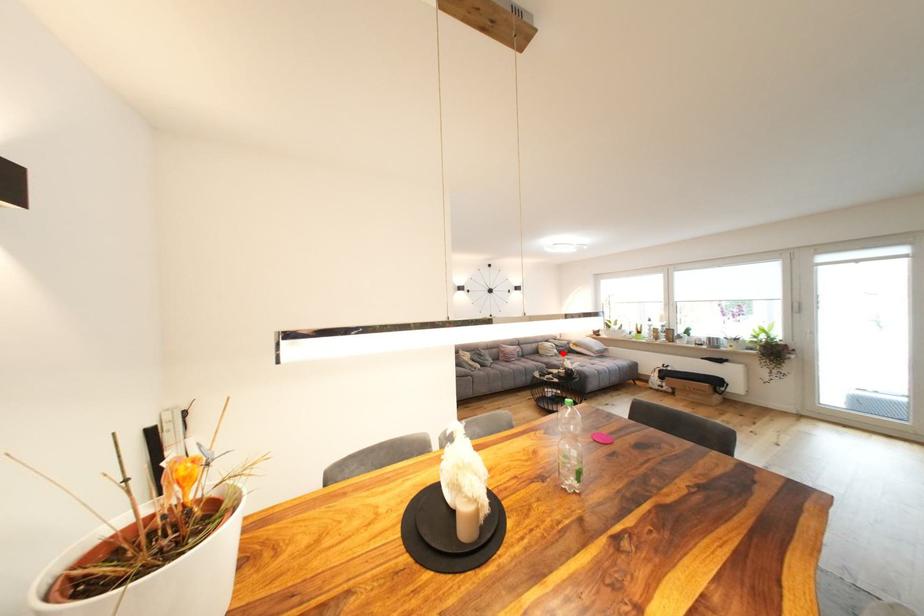
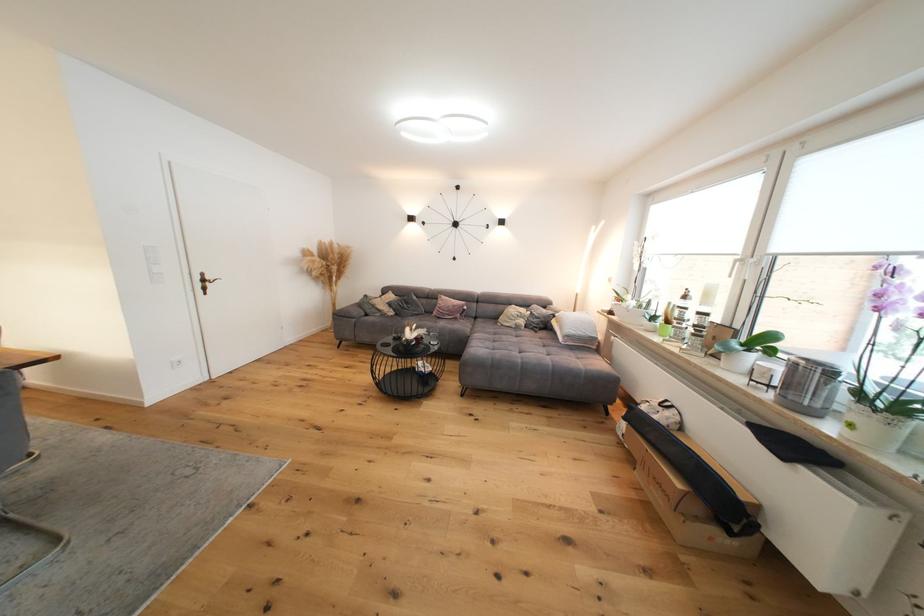
Locate, in the second image, the point that corresponds to the highlighted location in the first image.

(529, 323)